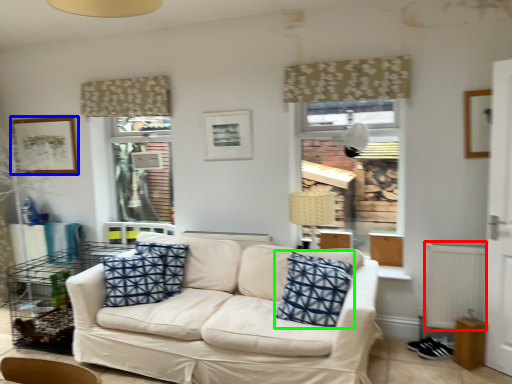
Question: Based on their relative distances, which object is nearer to radiator (highlighted by a red box)? Choose from picture frame (highlighted by a blue box) and pillow (highlighted by a green box).

Choices:
 (A) picture frame
 (B) pillow

Answer: (B)